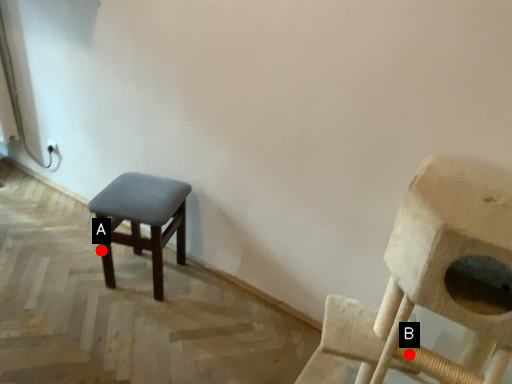
Question: Two points are circled on the image, labeled by A and B beside each circle. Which point is closer to the camera taking this photo?

Choices:
 (A) A is closer
 (B) B is closer

Answer: (B)